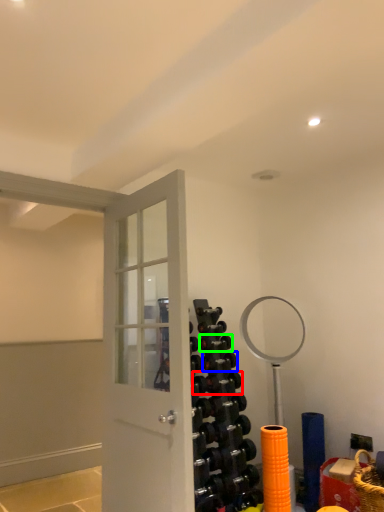
Question: Which object is the farthest from dumbbell (highlighted by a red box)? Choose among these: dumbbell (highlighted by a blue box) or dumbbell (highlighted by a green box).

Choices:
 (A) dumbbell
 (B) dumbbell

Answer: (B)